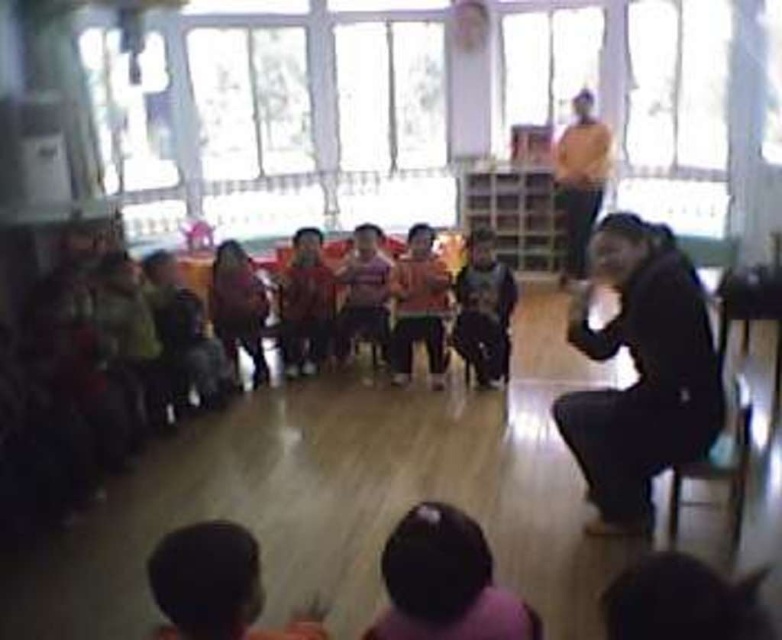
You are a photographer standing at the front of the room. You want to take a photo that includes both the black matte jacket at lower right and the orange sweater at upper center. Given that your camera has a maximum focus range of 3.8 meters, will you be able to capture both subjects in focus without moving your position?

The black matte jacket at lower right and orange sweater at upper center are 3.90 meters apart, which exceeds the camera maximum focus range of 3.8 meters. Therefore, you cannot capture both subjects in focus without moving.

Consider the image. You are standing at point (596, 125) and want to walk to point (454, 282). Is the path clear for you to walk straight ahead without needing to go around any obstacles?

Yes, the path is clear because point (454, 282) is in front of point (596, 125), so you can walk straight ahead without needing to go around any obstacles.

You are a photographer trying to capture a group photo of the children in the classroom. You notice the dark gray sweater at center and the orange sweater at upper center. Which sweater should you focus on to ensure both are in the frame?

The dark gray sweater at center is positioned on the left side of orange sweater at upper center, so focusing on the orange sweater at upper center would ensure both are in the frame as it is closer to the center and upper area.